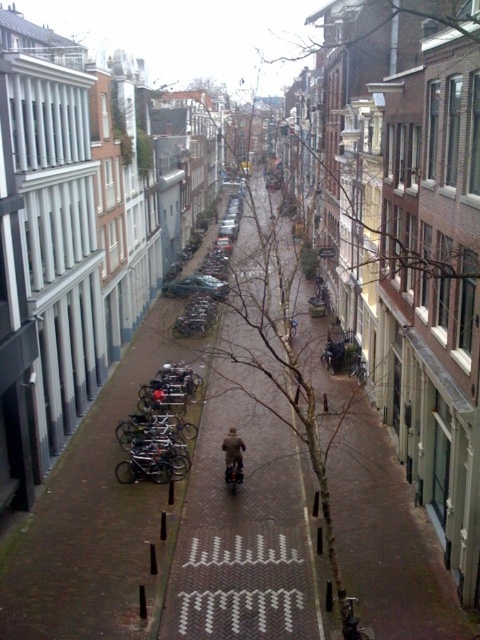
Question: Which of the following is the farthest from the observer?

Choices:
 (A) bare branches at center
 (B) black matte bicycles at left

Answer: (B)

Question: Is brown brick pavement at center further to camera compared to black matte bicycles at left?

Choices:
 (A) no
 (B) yes

Answer: (A)

Question: Which of the following is the closest to the observer?

Choices:
 (A) bare branches at center
 (B) black matte bicycles at left

Answer: (A)

Question: Among these points, which one is nearest to the camera?

Choices:
 (A) (132, 468)
 (B) (236, 436)

Answer: (B)

Question: Can you confirm if bare branches at center is thinner than brown leather jacket at center?

Choices:
 (A) no
 (B) yes

Answer: (A)

Question: Does black matte bicycles at left come in front of brown leather jacket at center?

Choices:
 (A) no
 (B) yes

Answer: (A)